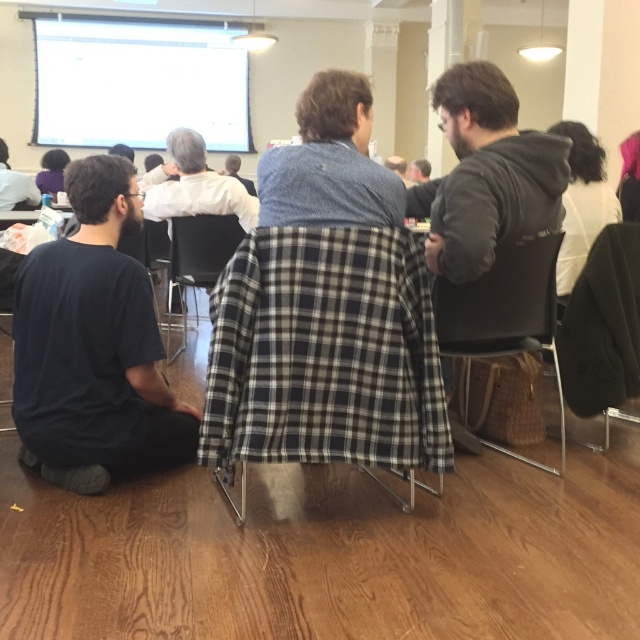
Question: Which point is farther to the camera?

Choices:
 (A) black fabric chair at right
 (B) smooth gray sweater at center
 (C) plaid fabric chair at center

Answer: (B)

Question: Observing the image, what is the correct spatial positioning of black plaid fabric at center in reference to dark gray hoodie at center?

Choices:
 (A) left
 (B) right

Answer: (A)

Question: From the image, what is the correct spatial relationship of blue plaid shirt at center in relation to smooth gray sweater at center?

Choices:
 (A) left
 (B) right

Answer: (A)

Question: Which point is farther to the camera?

Choices:
 (A) smooth gray sweater at center
 (B) plaid fabric chair at center

Answer: (A)

Question: Is white shirt at center to the left of plaid fabric chair at center from the viewer's perspective?

Choices:
 (A) no
 (B) yes

Answer: (B)

Question: Which point is closer to the camera taking this photo?

Choices:
 (A) (282, 198)
 (B) (42, 289)

Answer: (A)